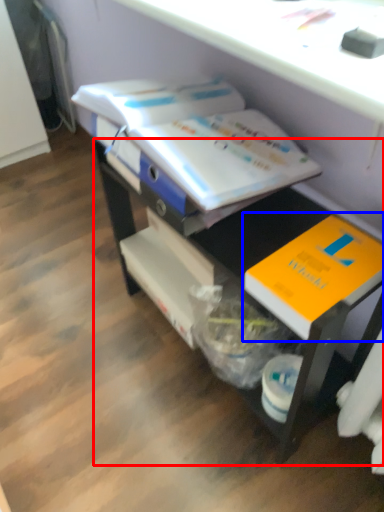
Question: Which of the following is the closest to the observer, desk (highlighted by a red box) or book (highlighted by a blue box)?

Choices:
 (A) desk
 (B) book

Answer: (A)